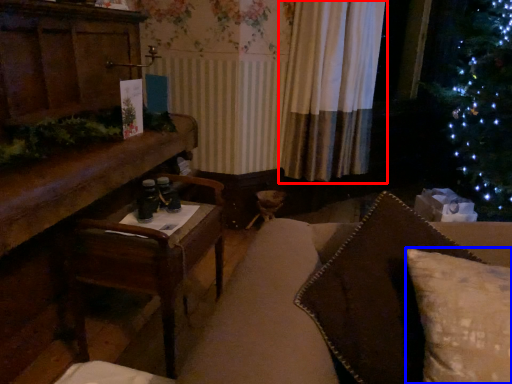
Question: Which object appears farthest to the camera in this image, curtain (highlighted by a red box) or pillow (highlighted by a blue box)?

Choices:
 (A) curtain
 (B) pillow

Answer: (A)